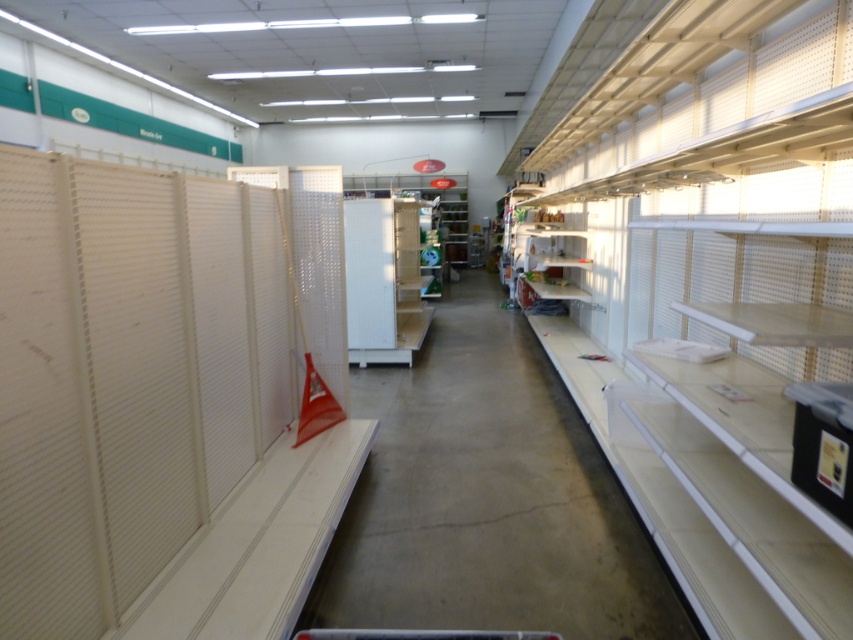
Question: Is white plastic shelves at center above white matte shelf at center?

Choices:
 (A) yes
 (B) no

Answer: (B)

Question: Which object is closer to the camera taking this photo?

Choices:
 (A) white matte shelf at center
 (B) white plastic shelves at center

Answer: (B)

Question: Which point is farther to the camera?

Choices:
 (A) white matte shelf at center
 (B) white plastic shelves at center

Answer: (A)

Question: Can you confirm if white plastic shelves at center is thinner than white matte shelf at center?

Choices:
 (A) no
 (B) yes

Answer: (B)

Question: Can you confirm if white plastic shelves at center is positioned above white matte shelf at center?

Choices:
 (A) no
 (B) yes

Answer: (A)